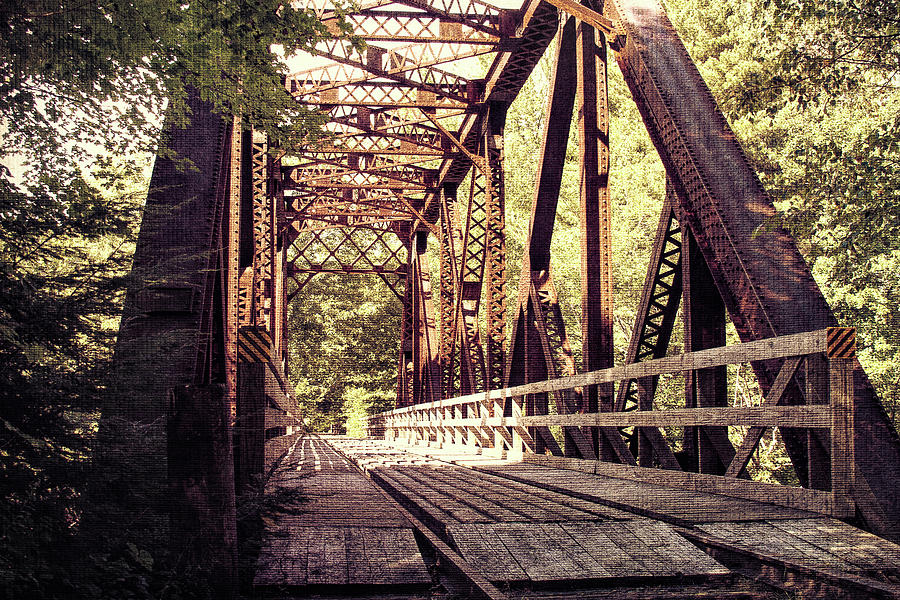
Identify the location of support beams. This screenshot has width=900, height=600. (651, 307), (556, 356), (464, 276).